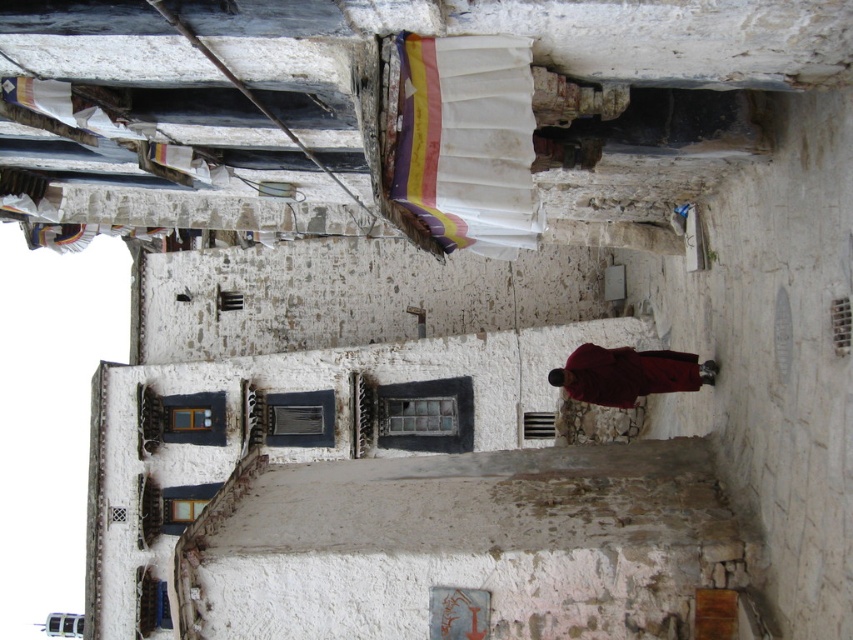
You are a delivery person trying to navigate through the narrow alleyway. You see a white fabric at upper center and a maroon woolen robe at center. Which object is positioned higher up in the alleyway?

The white fabric at upper center is located above the maroon woolen robe at center, so it is positioned higher up in the alleyway.

You are standing in the alleyway and notice a point marked at coordinates (x=467, y=141). Based on the scene description, what object or feature is located at that point?

The point at coordinates (x=467, y=141) corresponds to the white fabric at upper center.

You are a delivery person carrying a package that requires a 20 meter clearance to deliver safely. You see the white fabric at upper center and the maroon woolen robe at center in the alleyway. Can you safely pass between them without hitting either?

The distance between the white fabric at upper center and the maroon woolen robe at center is 19.61 meters, which is slightly less than the required 20 meter clearance. Therefore, you cannot safely pass between them without the risk of hitting one or both objects.